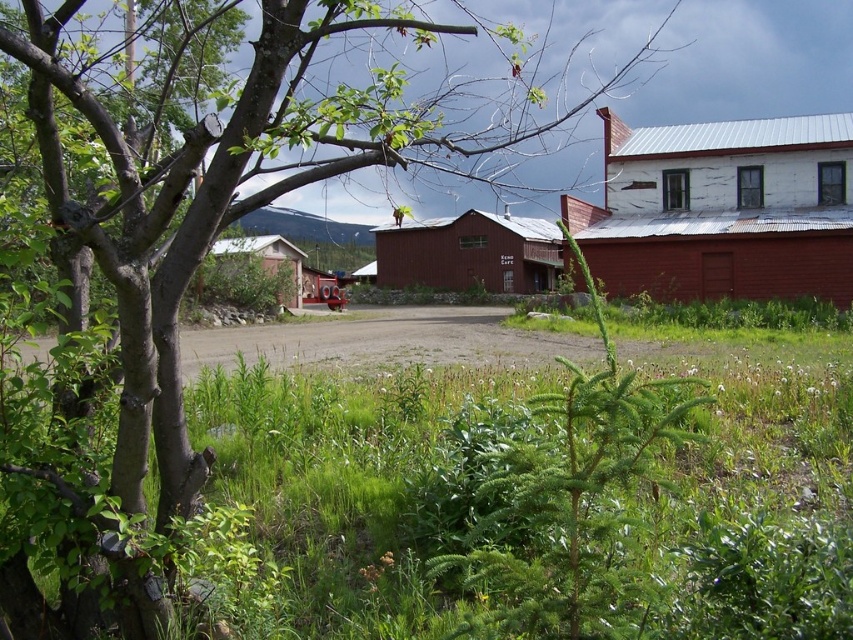
Question: Estimate the real-world distances between objects in this image. Which object is farther from the green leafy plant at center?

Choices:
 (A) rusty corrugated metal barn at right
 (B) rustic wood barn at center

Answer: (B)

Question: Which point is farther to the camera?

Choices:
 (A) rusty corrugated metal barn at right
 (B) rustic wood barn at center

Answer: (B)

Question: Does rusty corrugated metal barn at right come behind rustic wood barn at center?

Choices:
 (A) yes
 (B) no

Answer: (B)

Question: Which point is farther from the camera taking this photo?

Choices:
 (A) (624, 216)
 (B) (653, 483)
 (C) (389, 227)

Answer: (C)

Question: Is green leafy plant at center closer to the viewer compared to rustic wood barn at center?

Choices:
 (A) yes
 (B) no

Answer: (A)

Question: Is rusty corrugated metal barn at right below rustic wood barn at center?

Choices:
 (A) no
 (B) yes

Answer: (A)